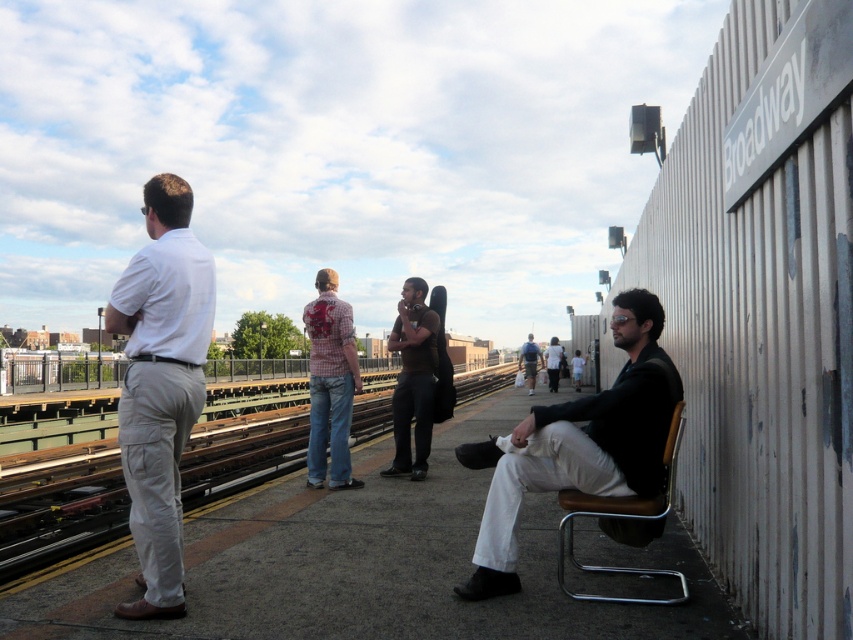
Question: Can you confirm if checkered fabric shirt at center is positioned below white cotton shirt at center?

Choices:
 (A) no
 (B) yes

Answer: (A)

Question: From the image, what is the correct spatial relationship of smooth metal train track at lower left in relation to white cotton shirt at center?

Choices:
 (A) left
 (B) right

Answer: (A)

Question: Which point is farther from the camera taking this photo?

Choices:
 (A) (671, 602)
 (B) (56, 548)
 (C) (518, 368)
 (D) (552, 344)

Answer: (C)

Question: Which point is farther to the camera?

Choices:
 (A) (537, 344)
 (B) (416, 378)

Answer: (A)

Question: Is matte black jacket at right closer to the viewer compared to smooth metal train track at lower left?

Choices:
 (A) no
 (B) yes

Answer: (B)

Question: Which is nearer to the white cotton shirt at left?

Choices:
 (A) white cotton shirt at center
 (B) matte black jacket at right

Answer: (B)